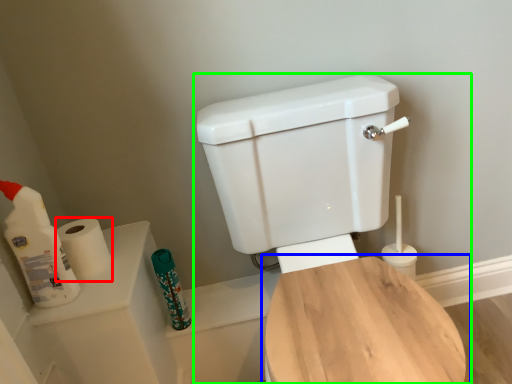
Question: Considering the real-world distances, which object is closest to toilet paper (highlighted by a red box)? toilet (highlighted by a blue box) or toilet (highlighted by a green box).

Choices:
 (A) toilet
 (B) toilet

Answer: (B)